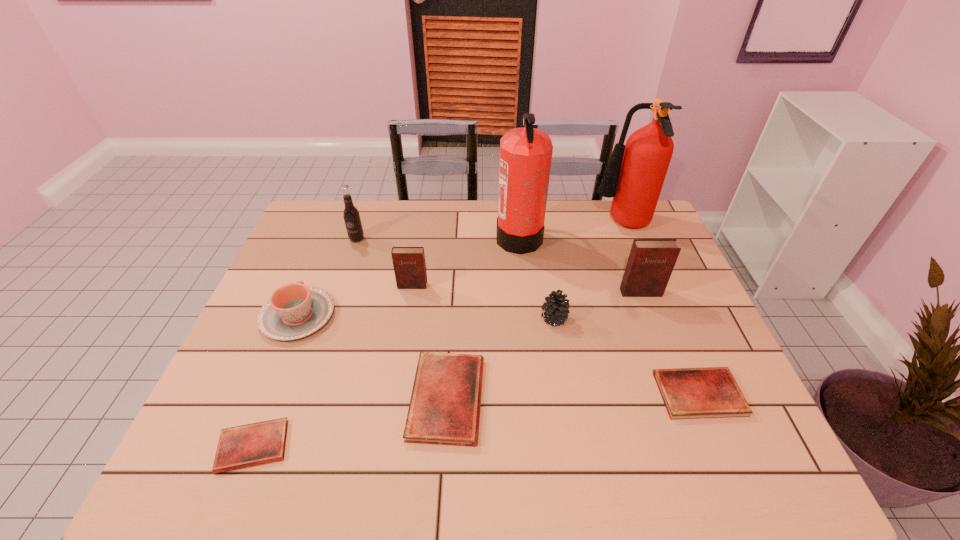
Identify the location of vacant area situated on the left of the third shortest diary. (345, 399).

This screenshot has height=540, width=960. I want to click on vacant space situated on the left of the second shortest diary, so click(557, 394).

In order to click on blank space located on the back of the shortest object in this screenshot , I will do `click(281, 375)`.

Image resolution: width=960 pixels, height=540 pixels. I want to click on root beer that is at the far edge, so click(x=352, y=220).

You are a GUI agent. You are given a task and a screenshot of the screen. Output one action in this format:
    pyautogui.click(x=<x>, y=<y>)
    Task: Click on the chinaware at the left edge
    
    Given the screenshot: What is the action you would take?
    pyautogui.click(x=294, y=311)

You are a GUI agent. You are given a task and a screenshot of the screen. Output one action in this format:
    pyautogui.click(x=<x>, y=<y>)
    Task: Click on the diary that is at the left edge
    This screenshot has height=540, width=960.
    Given the screenshot: What is the action you would take?
    pyautogui.click(x=259, y=443)

Find the location of a particular element. fire extinguisher present at the right edge is located at coordinates (634, 176).

Locate an element on the screen. The height and width of the screenshot is (540, 960). object present at the near left corner is located at coordinates [x=259, y=443].

Identify the location of object positioned at the far right corner. (634, 176).

In the image, there is a desktop. Identify the location of vacant space at the far edge. The width and height of the screenshot is (960, 540). (486, 217).